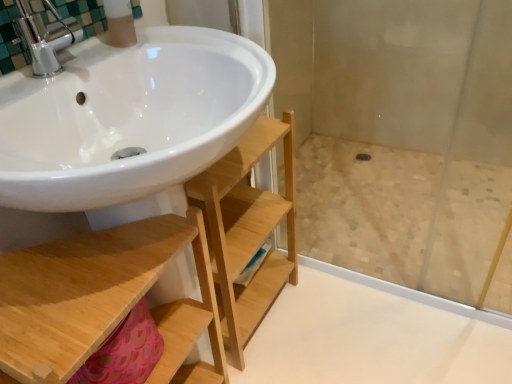
Question: Does natural wood shelf at lower left come behind matte plastic soap dispenser at upper left?

Choices:
 (A) no
 (B) yes

Answer: (A)

Question: Considering the relative sizes of natural wood shelf at lower left and matte plastic soap dispenser at upper left in the image provided, is natural wood shelf at lower left thinner than matte plastic soap dispenser at upper left?

Choices:
 (A) yes
 (B) no

Answer: (B)

Question: Is natural wood shelf at lower left closer to the viewer compared to matte plastic soap dispenser at upper left?

Choices:
 (A) yes
 (B) no

Answer: (A)

Question: Is natural wood shelf at lower left bigger than matte plastic soap dispenser at upper left?

Choices:
 (A) yes
 (B) no

Answer: (A)

Question: Does natural wood shelf at lower left contain matte plastic soap dispenser at upper left?

Choices:
 (A) yes
 (B) no

Answer: (B)

Question: Considering the relative positions of matte plastic soap dispenser at upper left and natural wood shelf at lower left in the image provided, is matte plastic soap dispenser at upper left to the left or to the right of natural wood shelf at lower left?

Choices:
 (A) right
 (B) left

Answer: (A)

Question: Is matte plastic soap dispenser at upper left bigger or smaller than natural wood shelf at lower left?

Choices:
 (A) small
 (B) big

Answer: (A)

Question: Is matte plastic soap dispenser at upper left wider or thinner than natural wood shelf at lower left?

Choices:
 (A) wide
 (B) thin

Answer: (B)

Question: Is point (112, 44) positioned closer to the camera than point (224, 170)?

Choices:
 (A) closer
 (B) farther

Answer: (A)

Question: Is transparent glass shower door at center spatially inside matte plastic soap dispenser at upper left, or outside of it?

Choices:
 (A) outside
 (B) inside

Answer: (A)

Question: Based on their positions, is transparent glass shower door at center located to the left or right of matte plastic soap dispenser at upper left?

Choices:
 (A) left
 (B) right

Answer: (B)

Question: From a real-world perspective, relative to matte plastic soap dispenser at upper left, is transparent glass shower door at center vertically above or below?

Choices:
 (A) below
 (B) above

Answer: (A)

Question: Is point (336, 61) closer or farther from the camera than point (110, 21)?

Choices:
 (A) closer
 (B) farther

Answer: (B)

Question: Does point (130, 38) appear closer or farther from the camera than point (290, 99)?

Choices:
 (A) farther
 (B) closer

Answer: (B)

Question: Choose the correct answer: Is matte plastic soap dispenser at upper left inside transparent glass shower door at center or outside it?

Choices:
 (A) outside
 (B) inside

Answer: (A)